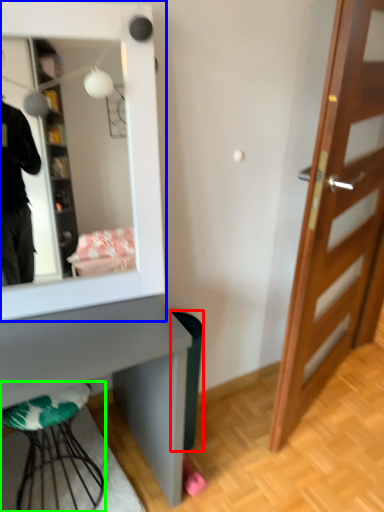
Question: Considering the real-world distances, which object is farthest from trash bin/can (highlighted by a red box)? mirror (highlighted by a blue box) or furniture (highlighted by a green box)?

Choices:
 (A) mirror
 (B) furniture

Answer: (A)